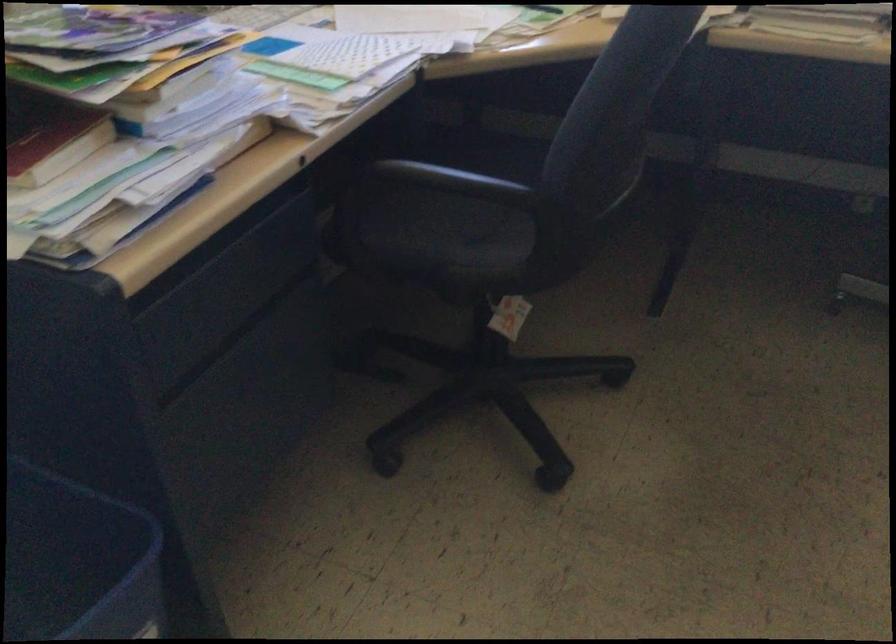
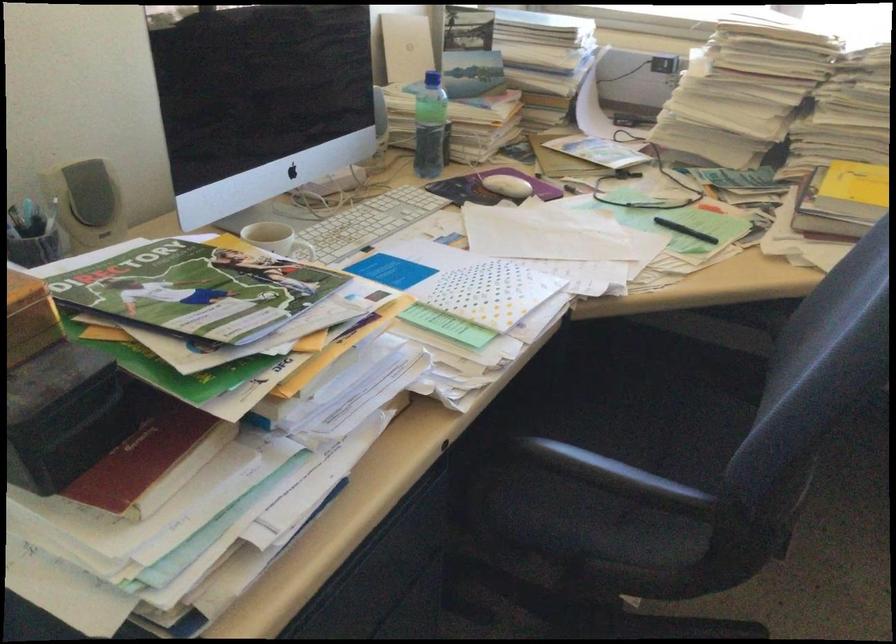
In the second image, find the point that corresponds to (440,175) in the first image.

(614, 474)